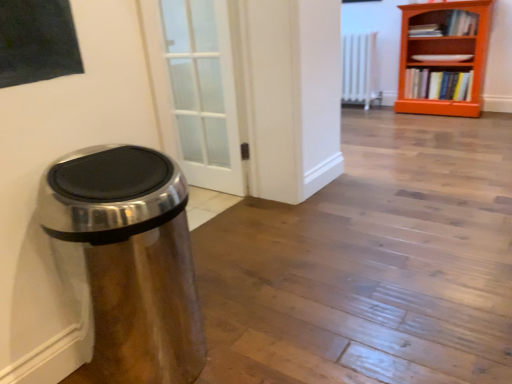
Identify the location of vacant space behind satin metallic trash can at left. This screenshot has height=384, width=512. (216, 299).